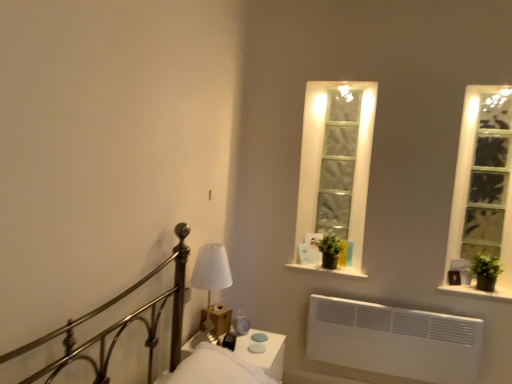
Find the location of a particular element. The width and height of the screenshot is (512, 384). blank space situated above white fabric lampshade at center (from a real-world perspective) is located at coordinates (208, 251).